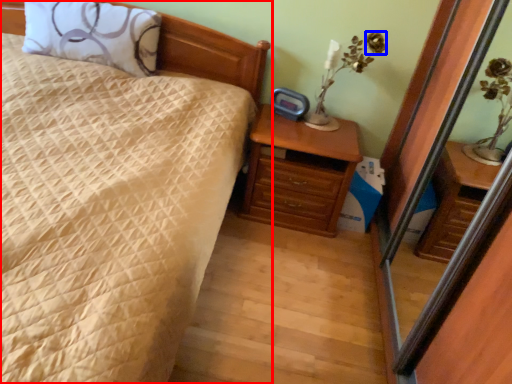
Question: Which object appears farthest to the camera in this image, bed (highlighted by a red box) or flower (highlighted by a blue box)?

Choices:
 (A) bed
 (B) flower

Answer: (B)